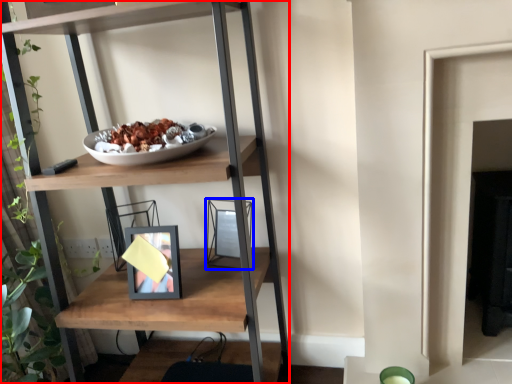
Question: Which object is closer to the camera taking this photo, shelf (highlighted by a red box) or picture frame (highlighted by a blue box)?

Choices:
 (A) shelf
 (B) picture frame

Answer: (A)